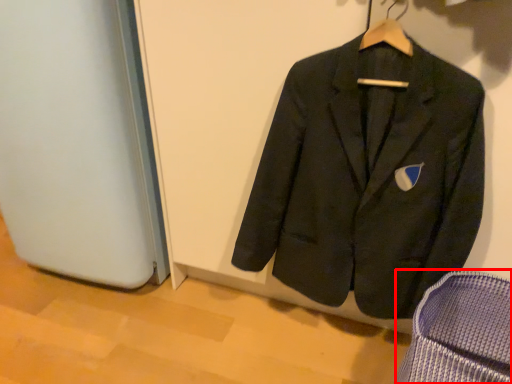
Question: From the image's perspective, where is armchair (annotated by the red box) located in relation to suit in the image?

Choices:
 (A) above
 (B) below

Answer: (B)